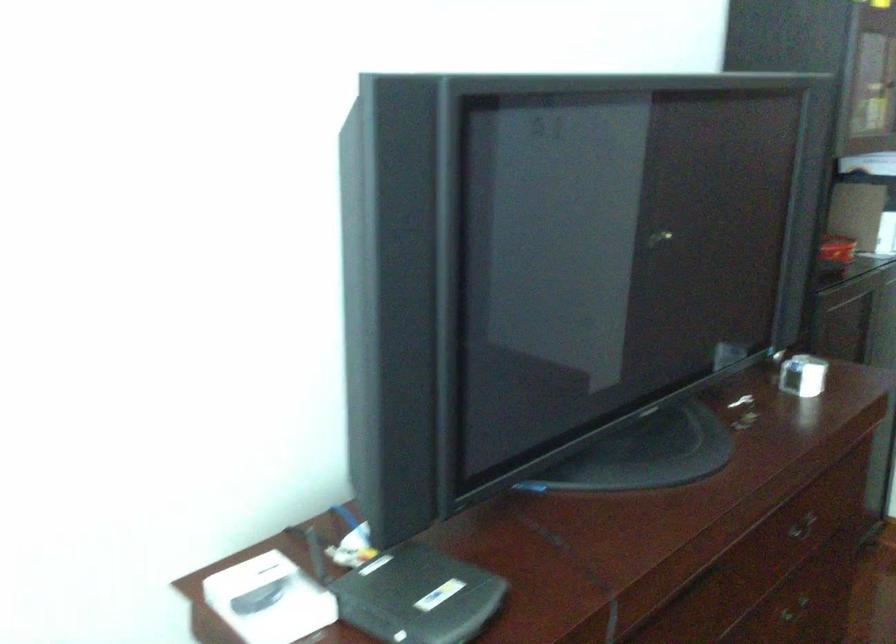
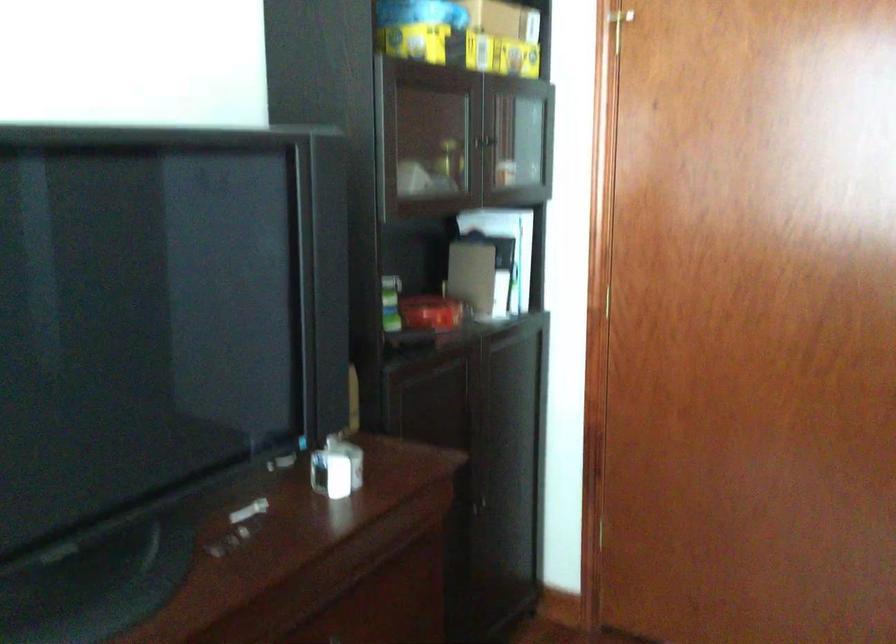
Question: Based on the continuous images, in which direction is the camera rotating? Reply with the corresponding letter.

Choices:
 (A) Left
 (B) Right
 (C) Up
 (D) Down

Answer: (B)